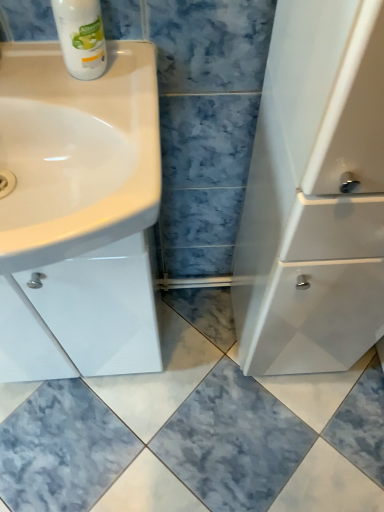
Locate an element on the screen. blank space situated above white glossy sink at left (from a real-world perspective) is located at coordinates (77, 98).